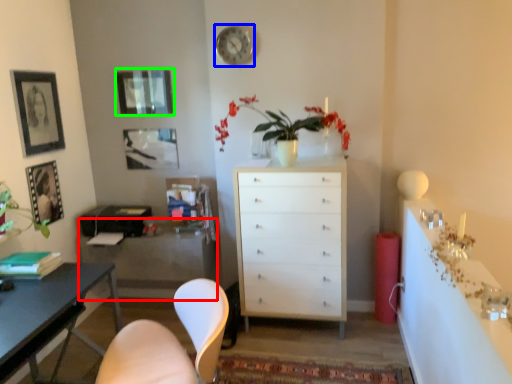
Question: Which object is the closest to the cabinetry (highlighted by a red box)? Choose among these: clock (highlighted by a blue box) or picture frame (highlighted by a green box).

Choices:
 (A) clock
 (B) picture frame

Answer: (B)